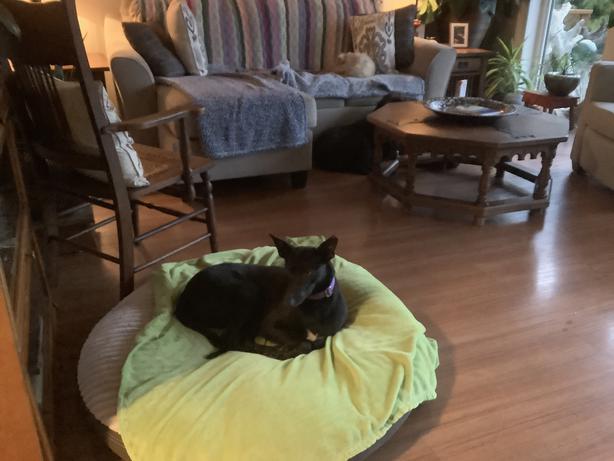
Image resolution: width=614 pixels, height=461 pixels. What are the coordinates of `pillows` in the screenshot? It's located at [192, 37], [165, 55], [382, 43], [398, 38].